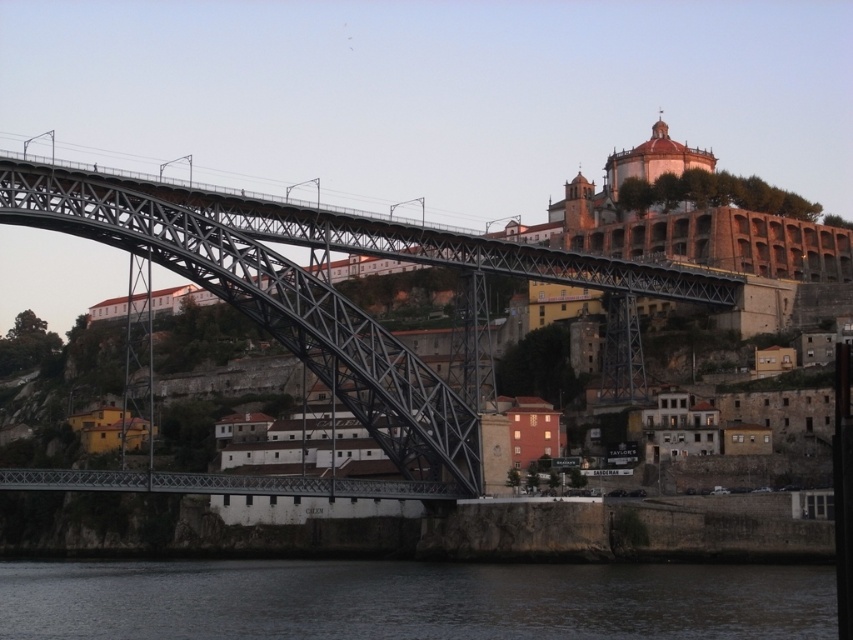
Question: Does dark water at lower center have a greater width compared to metallic steel bridge at left?

Choices:
 (A) yes
 (B) no

Answer: (A)

Question: Which point appears farthest from the camera in this image?

Choices:
 (A) (381, 413)
 (B) (575, 596)

Answer: (A)

Question: Is dark water at lower center smaller than metallic steel bridge at left?

Choices:
 (A) no
 (B) yes

Answer: (B)

Question: Does dark water at lower center appear on the right side of metallic steel bridge at left?

Choices:
 (A) no
 (B) yes

Answer: (A)